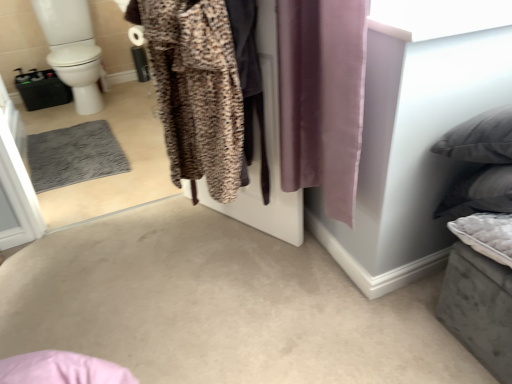
Question: Looking at their shapes, would you say brown textured robe at center is wider or thinner than purple silky curtain at center?

Choices:
 (A) thin
 (B) wide

Answer: (B)

Question: Is point (177, 59) closer or farther from the camera than point (302, 132)?

Choices:
 (A) farther
 (B) closer

Answer: (B)

Question: Based on their relative distances, which object is farther from the leopard print fabric at center?

Choices:
 (A) purple silky curtain at center
 (B) white glossy toilet bowl at left
 (C) brown textured robe at center

Answer: (B)

Question: Based on their relative distances, which object is nearer to the white glossy toilet bowl at left?

Choices:
 (A) brown textured robe at center
 (B) leopard print fabric at center
 (C) purple silky curtain at center

Answer: (B)